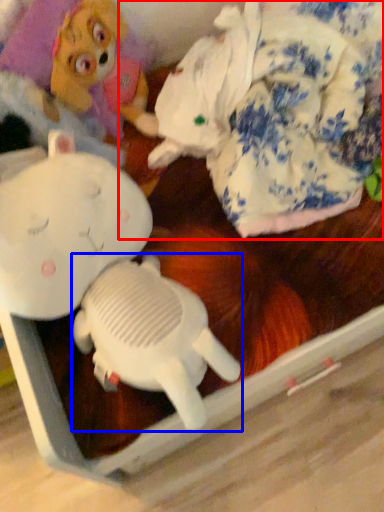
Question: Which point is further to the camera, toy (highlighted by a red box) or toy (highlighted by a blue box)?

Choices:
 (A) toy
 (B) toy

Answer: (A)